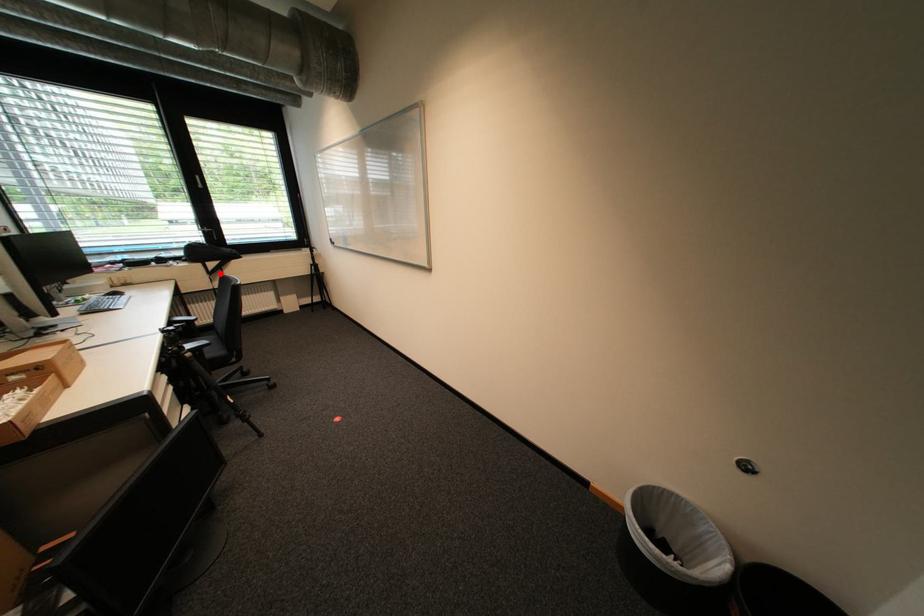
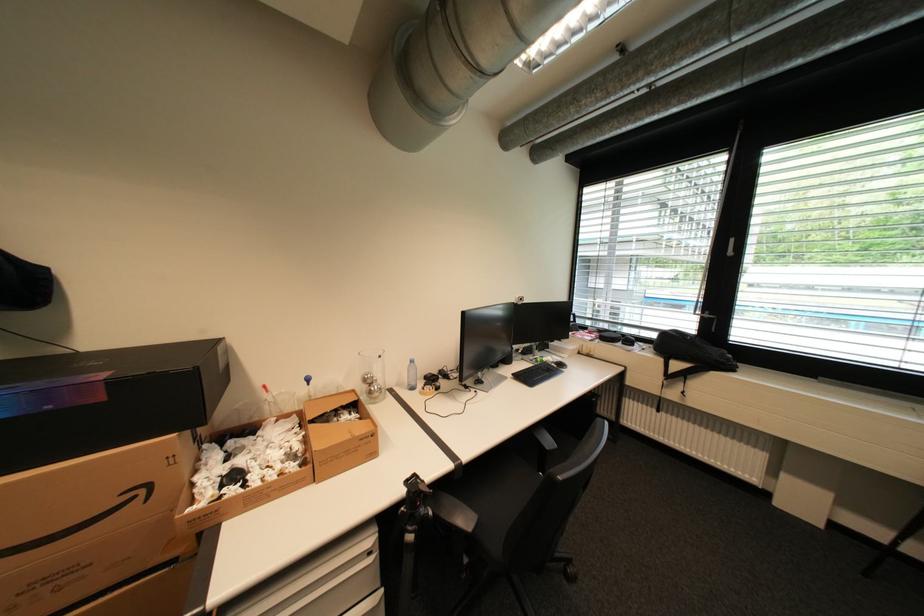
Where in the second image is the point corresponding to the highlighted location from the first image?

(678, 377)